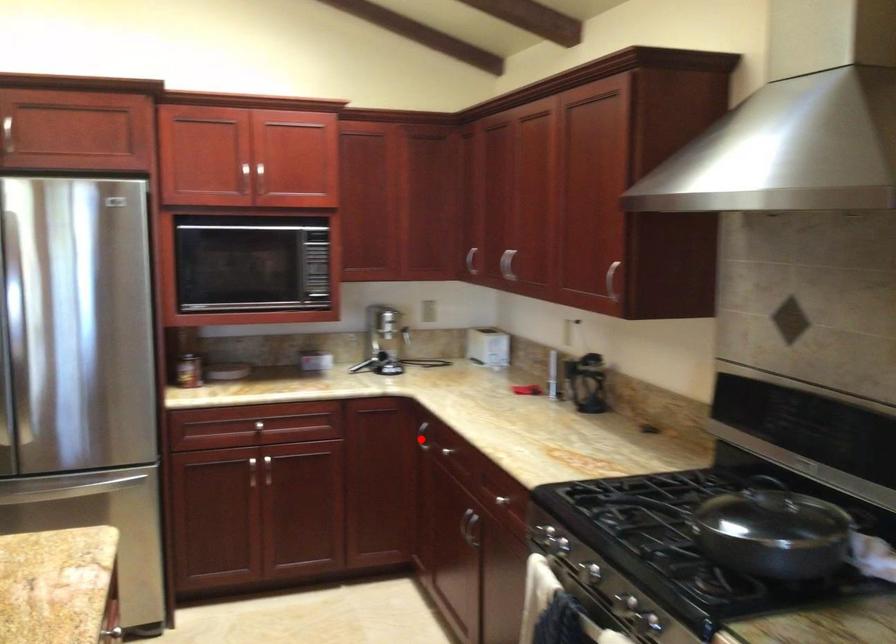
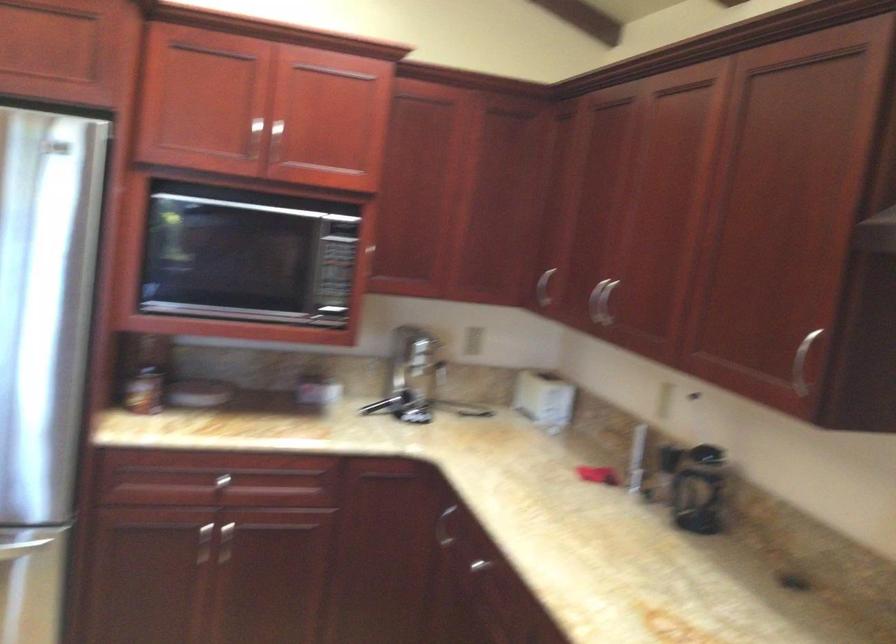
Question: I am providing you with two images of the same scene from different viewpoints. A red point is marked on the first image. Is the red point's position out of view in image 2?

Choices:
 (A) Yes
 (B) No

Answer: (B)